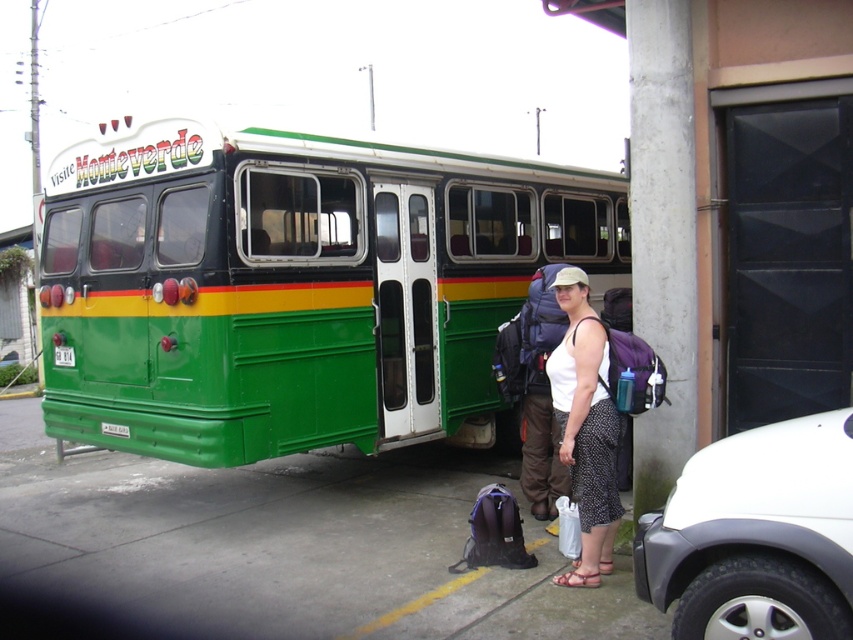
Does green matte bus at center have a lesser height compared to white fabric tank top at center?

In fact, green matte bus at center may be taller than white fabric tank top at center.

Is green matte bus at center in front of white fabric tank top at center?

No.

Between point (566, 237) and point (575, 392), which one is positioned in front?

Point (575, 392) is more forward.

Identify the location of green matte bus at center. (294, 288).